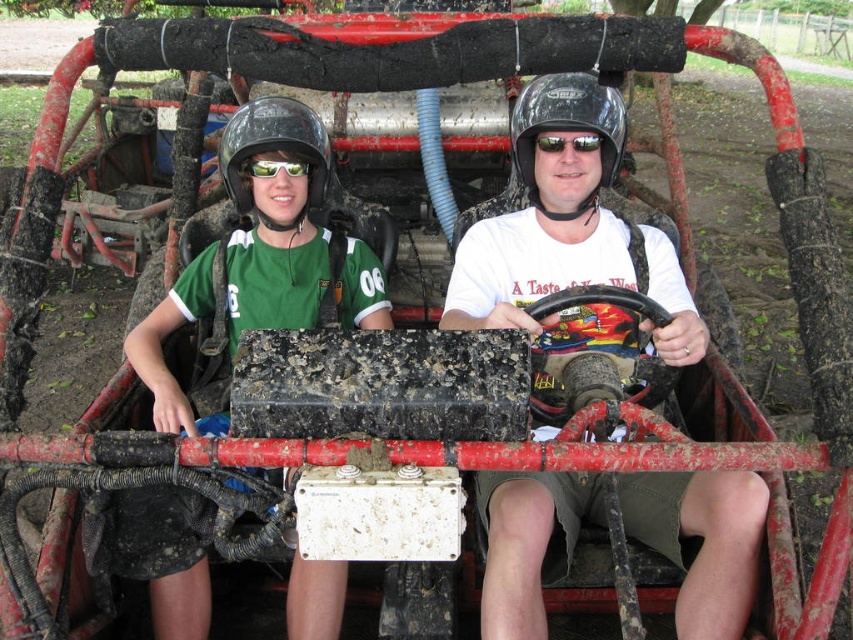
Does black matte goggles at center appear on the right side of green matte sunglasses at center?

Yes, black matte goggles at center is to the right of green matte sunglasses at center.

Is black matte goggles at center to the left of green matte sunglasses at center from the viewer's perspective?

No, black matte goggles at center is not to the left of green matte sunglasses at center.

Which is in front, point (566, 140) or point (248, 170)?

Positioned in front is point (566, 140).

Identify the location of black matte goggles at center. Image resolution: width=853 pixels, height=640 pixels. (567, 141).

Who is positioned more to the right, matte black helmet at center or black matte helmet at center?

black matte helmet at center is more to the right.

Is point (523, 540) positioned before point (556, 76)?

Yes, it is in front of point (556, 76).

Does point (496, 308) come in front of point (616, 131)?

Yes, it is in front of point (616, 131).

Identify the location of matte black helmet at center. (570, 240).

Who is positioned more to the left, black matte helmet at center or green matte sunglasses at center?

Positioned to the left is green matte sunglasses at center.

Is black matte helmet at center bigger than green matte sunglasses at center?

Yes.

Which is behind, point (527, 173) or point (262, 177)?

The point (262, 177) is behind.

Where is `black matte helmet at center`? black matte helmet at center is located at coordinates (566, 129).